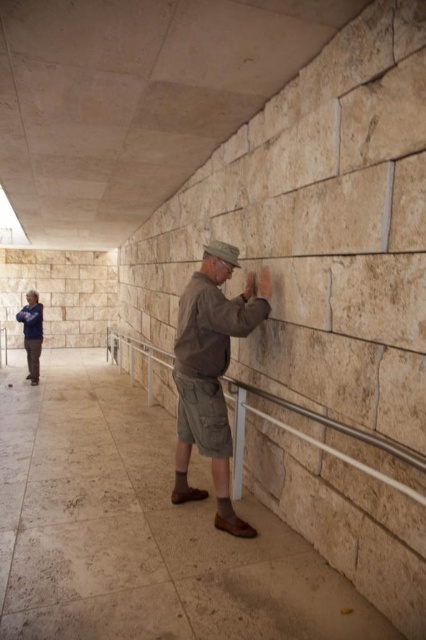
Looking at this image, can you confirm if brown cotton shirt at center is positioned below blue cotton shirt at lower left?

Yes, brown cotton shirt at center is below blue cotton shirt at lower left.

Is brown cotton shirt at center further to the viewer compared to blue cotton shirt at lower left?

No, it is not.

Does point (230, 333) lie in front of point (40, 337)?

Yes, point (230, 333) is closer to viewer.

Image resolution: width=426 pixels, height=640 pixels. What are the coordinates of `brown cotton shirt at center` in the screenshot? It's located at (210, 372).

Who is taller, satin silver railing at center or blue cotton shirt at lower left?

blue cotton shirt at lower left

How distant is satin silver railing at center from blue cotton shirt at lower left?

satin silver railing at center is 8.09 feet from blue cotton shirt at lower left.

Does point (391, 451) come in front of point (31, 340)?

That is True.

You are a GUI agent. You are given a task and a screenshot of the screen. Output one action in this format:
    pyautogui.click(x=<x>, y=<y>)
    Task: Click on the satin silver railing at center
    Image resolution: width=426 pixels, height=640 pixels.
    Given the screenshot: What is the action you would take?
    pyautogui.click(x=313, y=438)

Consider the image. Does brown cotton shirt at center appear under satin silver railing at center?

Incorrect, brown cotton shirt at center is not positioned below satin silver railing at center.

Is point (178, 312) behind point (233, 484)?

No.

The width and height of the screenshot is (426, 640). I want to click on brown cotton shirt at center, so click(210, 372).